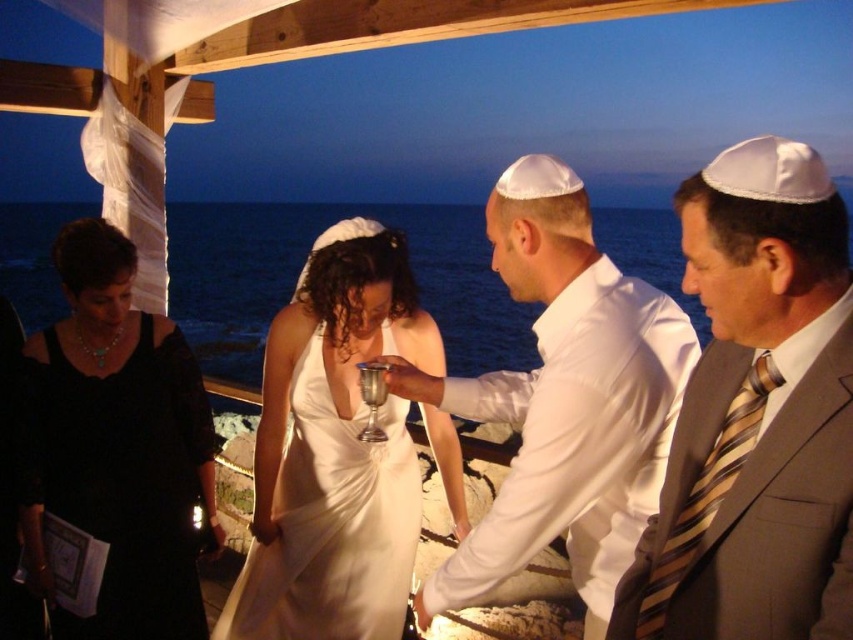
You are attending a wedding and need to locate the striped silk tie at right. According to the coordinates provided, where exactly is it positioned in the image?

The striped silk tie at right is located at point (756, 413) in the image.

You are a photographer at the wedding scene. You need to position yourself to capture both the black satin dress at lower left and the white satin dress at center in the same frame. Considering their heights, which dress should you focus on to ensure both are fully visible?

The black satin dress at lower left is taller than the white satin dress at center. To ensure both are fully visible in the frame, you should focus on the height of the black satin dress at lower left, as it is taller and requires more vertical space.

You are standing at the edge of the wooden structure in the scene. You see two points marked in the image. Which point, point (532, 452) or point (305, 493), is closer to you?

Point (532, 452) is closer to the camera than point (305, 493).